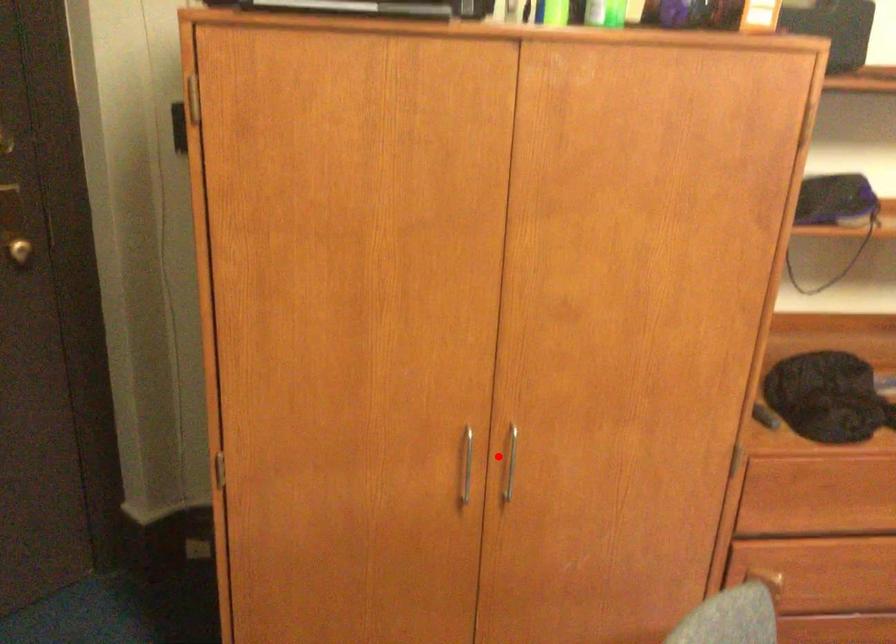
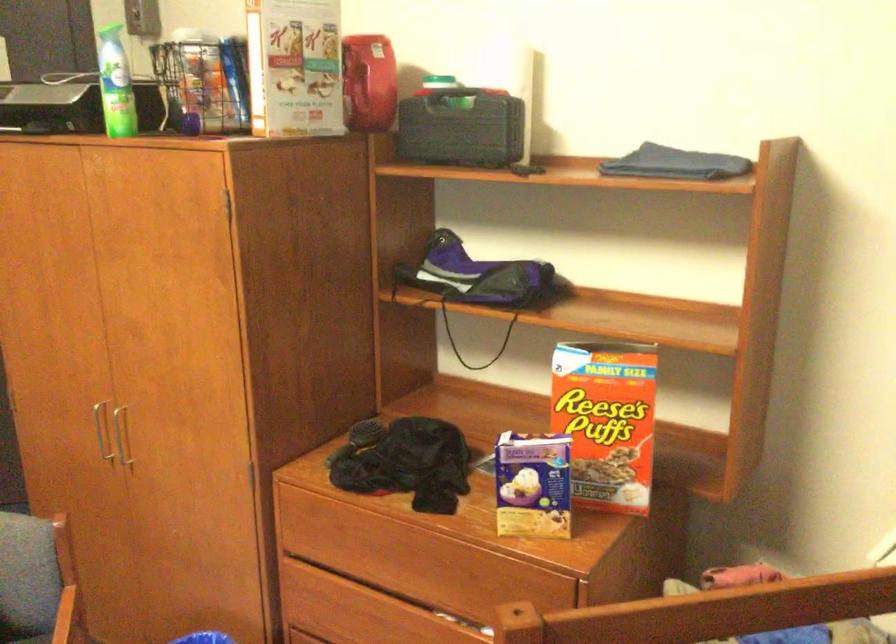
Question: I am providing you with two images of the same scene from different viewpoints. Given a red point in image1, look at the same physical point in image2. Is it:

Choices:
 (A) Closer to the viewpoint
 (B) Farther from the viewpoint

Answer: (B)